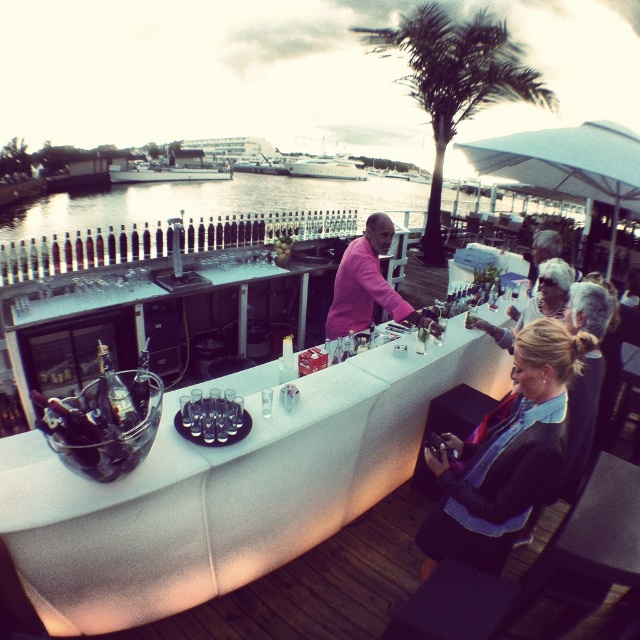
Can you confirm if white textured bar at center is positioned to the left of denim jacket at lower right?

Yes, white textured bar at center is to the left of denim jacket at lower right.

Does point (268, 531) lie in front of point (456, 483)?

That is False.

Who is more forward, (397, 394) or (534, 403)?

Positioned in front is point (534, 403).

Identify the location of white textured bar at center. This screenshot has height=640, width=640. (227, 488).

Is white textured bar at center bigger than green leafy palm tree at center?

Correct, white textured bar at center is larger in size than green leafy palm tree at center.

Is white textured bar at center taller than green leafy palm tree at center?

Correct, white textured bar at center is much taller as green leafy palm tree at center.

Is point (272, 372) in front of point (477, 76)?

Yes, it is in front of point (477, 76).

I want to click on white textured bar at center, so (227, 488).

Between denim jacket at lower right and green leafy palm tree at center, which one is positioned higher?

green leafy palm tree at center

Does point (532, 445) lie behind point (493, 51)?

No.

At what (x,y) coordinates should I click in order to perform the action: click on denim jacket at lower right. Please return your answer as a coordinate pair (x, y). This screenshot has width=640, height=640. Looking at the image, I should click on (506, 458).